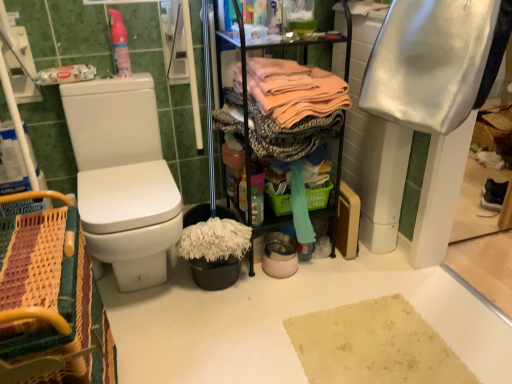
Identify the location of free point in front of pink matte spray bottle at upper left. (113, 81).